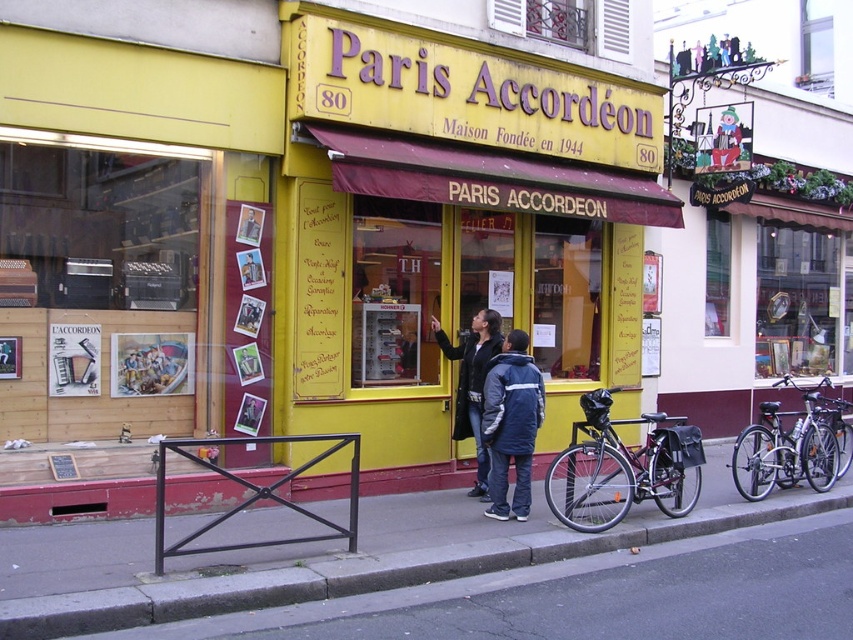
Can you confirm if dark blue jacket at center is bigger than black matte bicycle at center?

Actually, dark blue jacket at center might be smaller than black matte bicycle at center.

Locate an element on the screen. The width and height of the screenshot is (853, 640). dark blue jacket at center is located at coordinates (496, 406).

Is concrete sidewalk at center closer to camera compared to black matte bicycle at center?

Yes, concrete sidewalk at center is in front of black matte bicycle at center.

Which is in front, point (814, 550) or point (680, 426)?

Point (814, 550)

Image resolution: width=853 pixels, height=640 pixels. What are the coordinates of `concrete sidewalk at center` in the screenshot? It's located at (413, 564).

Who is more distant from viewer, [590,435] or [537,428]?

The point [590,435] is more distant.

Does black matte bicycle at center have a greater height compared to blue nylon jacket at center?

In fact, black matte bicycle at center may be shorter than blue nylon jacket at center.

Is point (585, 484) positioned in front of point (515, 330)?

Yes, point (585, 484) is in front of point (515, 330).

Image resolution: width=853 pixels, height=640 pixels. In order to click on black matte bicycle at center in this screenshot , I will do `click(625, 465)`.